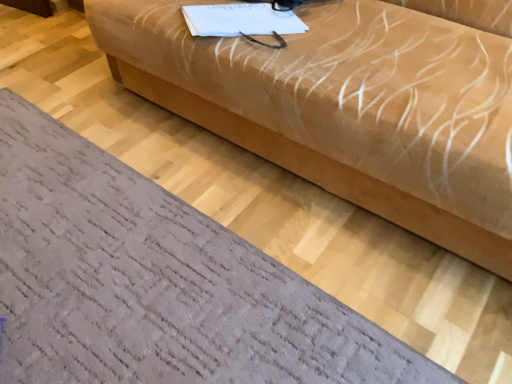
Question: Is beige fabric couch at center positioned beyond the bounds of textured gray rug at lower left?

Choices:
 (A) yes
 (B) no

Answer: (A)

Question: Does beige fabric couch at center appear on the left side of textured gray rug at lower left?

Choices:
 (A) no
 (B) yes

Answer: (A)

Question: From the image's perspective, does beige fabric couch at center appear lower than textured gray rug at lower left?

Choices:
 (A) yes
 (B) no

Answer: (B)

Question: Considering the relative sizes of beige fabric couch at center and textured gray rug at lower left in the image provided, is beige fabric couch at center thinner than textured gray rug at lower left?

Choices:
 (A) no
 (B) yes

Answer: (B)

Question: Is beige fabric couch at center shorter than textured gray rug at lower left?

Choices:
 (A) no
 (B) yes

Answer: (A)

Question: Is beige fabric couch at center in front of textured gray rug at lower left?

Choices:
 (A) no
 (B) yes

Answer: (B)

Question: Can you confirm if textured gray rug at lower left is positioned to the right of beige fabric couch at center?

Choices:
 (A) yes
 (B) no

Answer: (B)

Question: Is textured gray rug at lower left smaller than beige fabric couch at center?

Choices:
 (A) yes
 (B) no

Answer: (A)

Question: From a real-world perspective, is textured gray rug at lower left under beige fabric couch at center?

Choices:
 (A) no
 (B) yes

Answer: (B)

Question: From the image's perspective, is textured gray rug at lower left beneath beige fabric couch at center?

Choices:
 (A) yes
 (B) no

Answer: (A)

Question: Is textured gray rug at lower left beside beige fabric couch at center?

Choices:
 (A) no
 (B) yes

Answer: (A)

Question: From the image's perspective, is textured gray rug at lower left on top of beige fabric couch at center?

Choices:
 (A) yes
 (B) no

Answer: (B)

Question: In terms of height, does beige fabric couch at center look taller or shorter compared to textured gray rug at lower left?

Choices:
 (A) tall
 (B) short

Answer: (A)